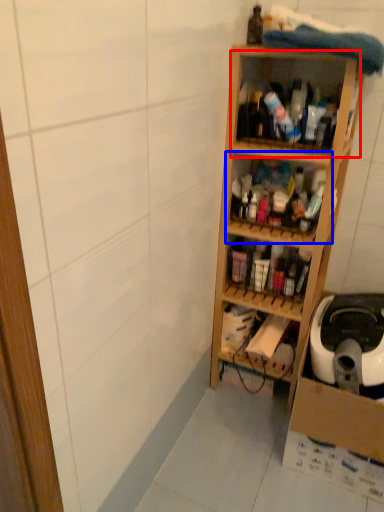
Question: Which of the following is the closest to the observer, shelf (highlighted by a red box) or shelf (highlighted by a blue box)?

Choices:
 (A) shelf
 (B) shelf

Answer: (A)